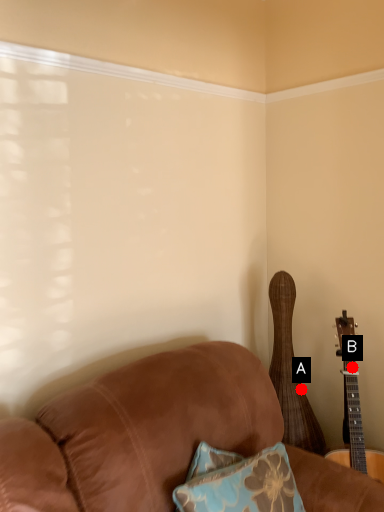
Question: Two points are circled on the image, labeled by A and B beside each circle. Among these points, which one is farthest from the camera?

Choices:
 (A) A is further
 (B) B is further

Answer: (A)